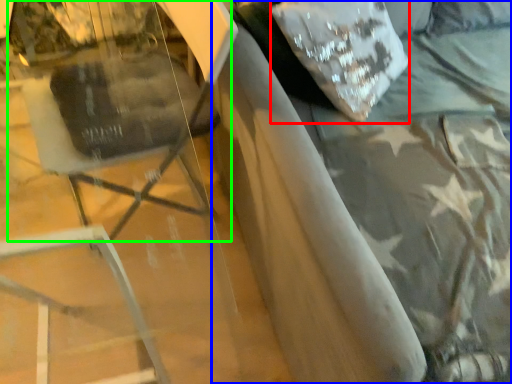
Question: Which object is the closest to the pillow (highlighted by a red box)? Choose among these: bed (highlighted by a blue box) or swivel chair (highlighted by a green box).

Choices:
 (A) bed
 (B) swivel chair

Answer: (A)